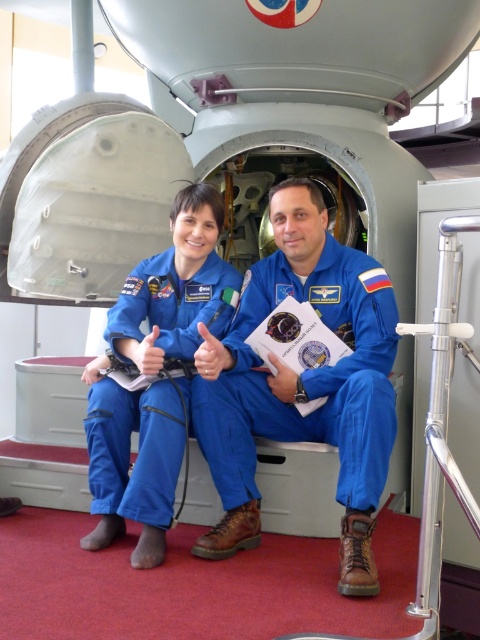
Question: Is the position of blue fabric spacesuit at center less distant than that of matte blue jumpsuit at center?

Choices:
 (A) yes
 (B) no

Answer: (A)

Question: Can you confirm if blue fabric spacesuit at center is positioned to the left of matte blue jumpsuit at center?

Choices:
 (A) yes
 (B) no

Answer: (B)

Question: Is blue fabric spacesuit at center to the right of matte blue jumpsuit at center from the viewer's perspective?

Choices:
 (A) yes
 (B) no

Answer: (A)

Question: Among these objects, which one is nearest to the camera?

Choices:
 (A) blue fabric spacesuit at center
 (B) matte blue jumpsuit at center

Answer: (A)